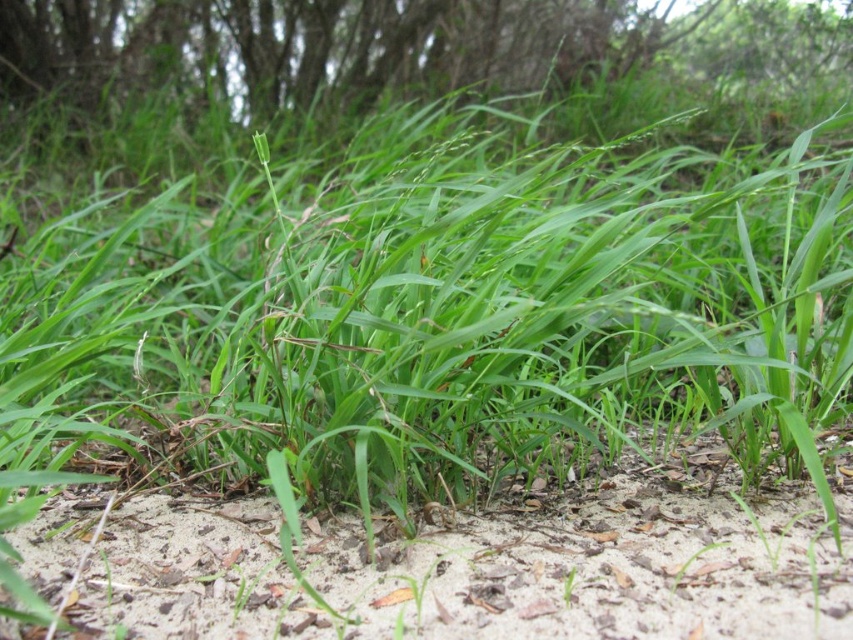
You are a gardener trying to plant a new flower. You need to determine where to dig a hole. Based on the image, which area should you choose between the light brown sandy soil at center and the green grass at upper center?

The light brown sandy soil at center is in front of the green grass at upper center, so you should dig in the light brown sandy soil at center because it is closer to the surface and more suitable for planting.

You are standing in the grassy area shown in the image. There are two points marked on the ground. From your perspective, which point is closer to you, point (206, 586) or point (440, 86)?

Point (206, 586) is closer to the viewer than point (440, 86).

You are standing at the origin point of the image. Where is the light brown sandy soil at center located in terms of coordinates?

The light brown sandy soil at center is located at coordinates point (596, 570).